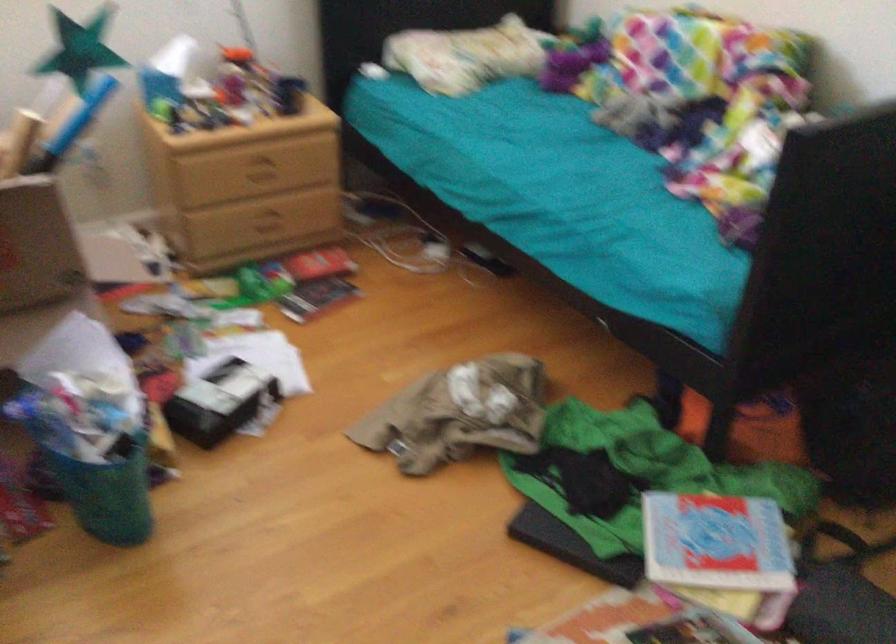
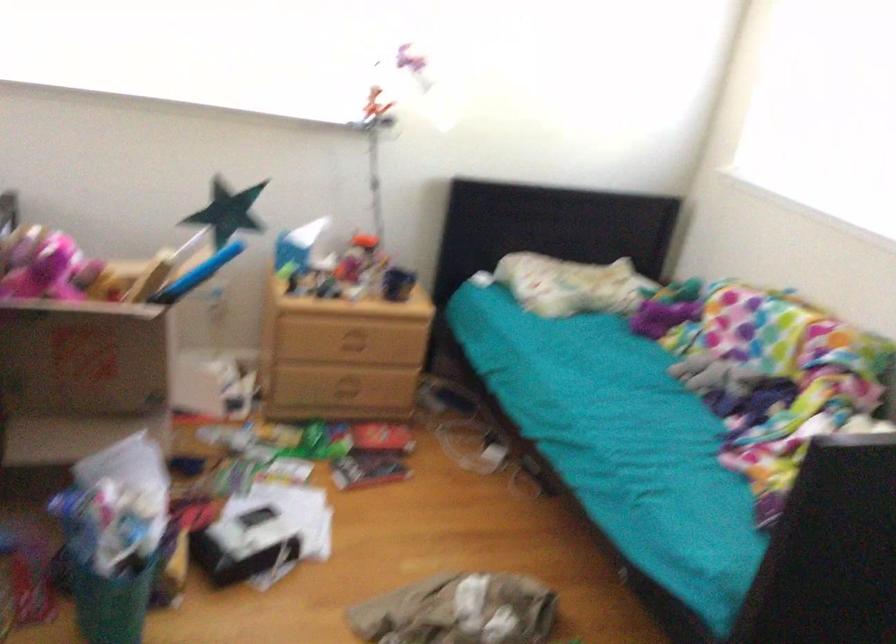
Which direction would the cameraman need to move to produce the second image?

The cameraman walked toward right, backward.